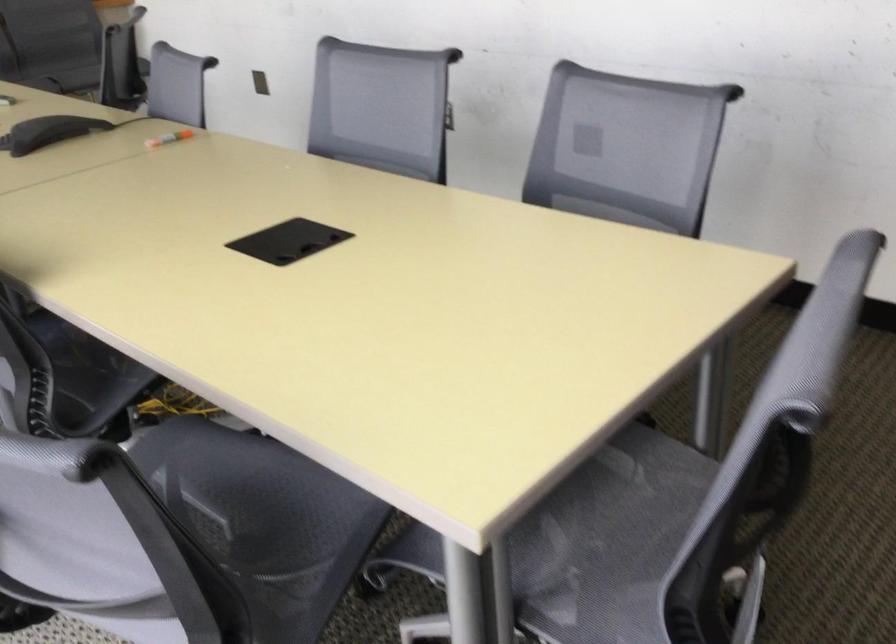
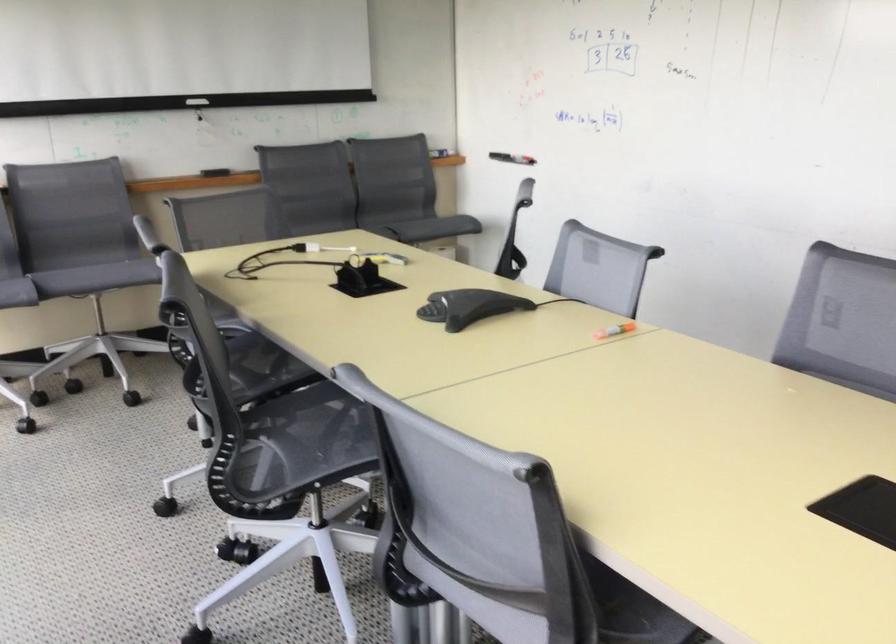
Question: In a continuous first-person perspective shot, in which direction is the camera moving?

Choices:
 (A) Left
 (B) Right
 (C) Forward
 (D) Backward

Answer: (A)